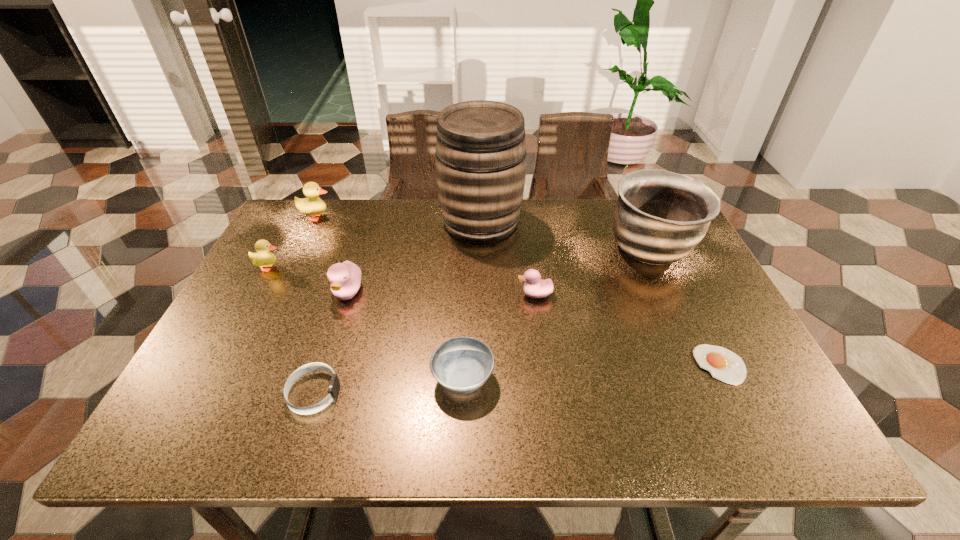
The image size is (960, 540). In order to click on the third shortest object in this screenshot , I will do click(462, 365).

Identify the location of wristband. Image resolution: width=960 pixels, height=540 pixels. (334, 385).

The image size is (960, 540). Identify the location of the shortest object. (723, 364).

Identify the location of vacant position located on the front of the wine bucket. (481, 307).

Locate an element on the screen. free spot located 0.300m on the front of the pottery is located at coordinates (708, 375).

The width and height of the screenshot is (960, 540). I want to click on vacant space located on the front-facing side of the bigger yellow duckling, so click(462, 217).

Locate an element on the screen. Image resolution: width=960 pixels, height=540 pixels. blank area located 0.340m on the front-facing side of the bigger pink duckling is located at coordinates (301, 440).

Locate an element on the screen. This screenshot has height=540, width=960. vacant space located 0.170m on the front-facing side of the third nearest duckling is located at coordinates (346, 267).

The height and width of the screenshot is (540, 960). I want to click on vacant point located on the front-facing side of the rightmost duckling, so click(450, 294).

At what (x,y) coordinates should I click in order to perform the action: click on blank area located on the front-facing side of the rightmost duckling. Please return your answer as a coordinate pair (x, y). Looking at the image, I should click on (435, 294).